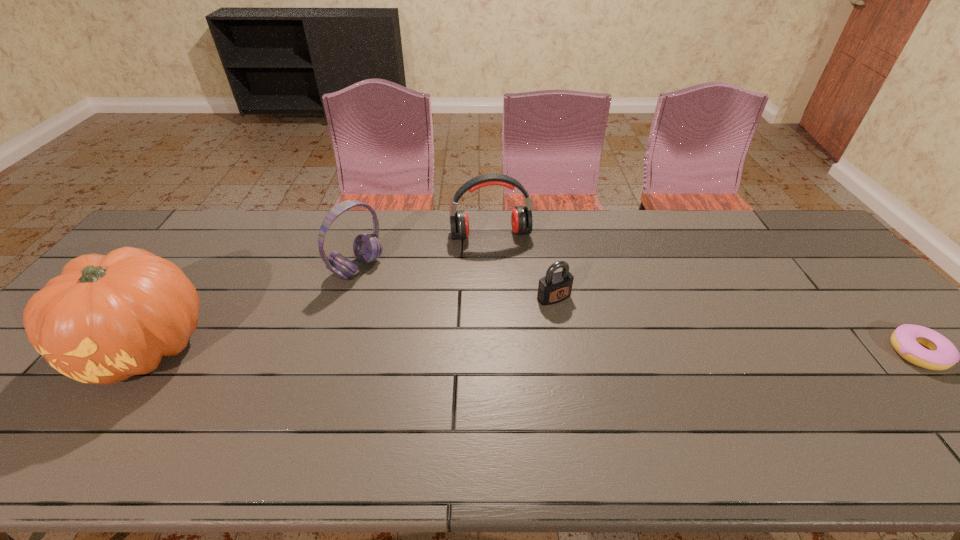
Where is `object identified as the closest to the leftmost object`? The width and height of the screenshot is (960, 540). object identified as the closest to the leftmost object is located at coordinates (367, 247).

At what (x,y) coordinates should I click in order to perform the action: click on object that stands as the second closest to the fourth tallest object. Please return your answer as a coordinate pair (x, y). Looking at the image, I should click on (367, 247).